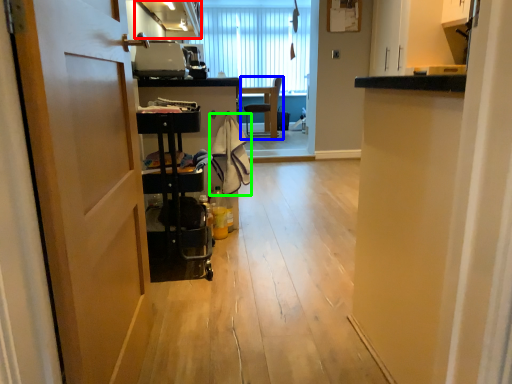
Question: Which object is positioned closest to cabinetry (highlighted by a red box)? Select from chair (highlighted by a blue box) and laundry (highlighted by a green box).

Choices:
 (A) chair
 (B) laundry

Answer: (B)